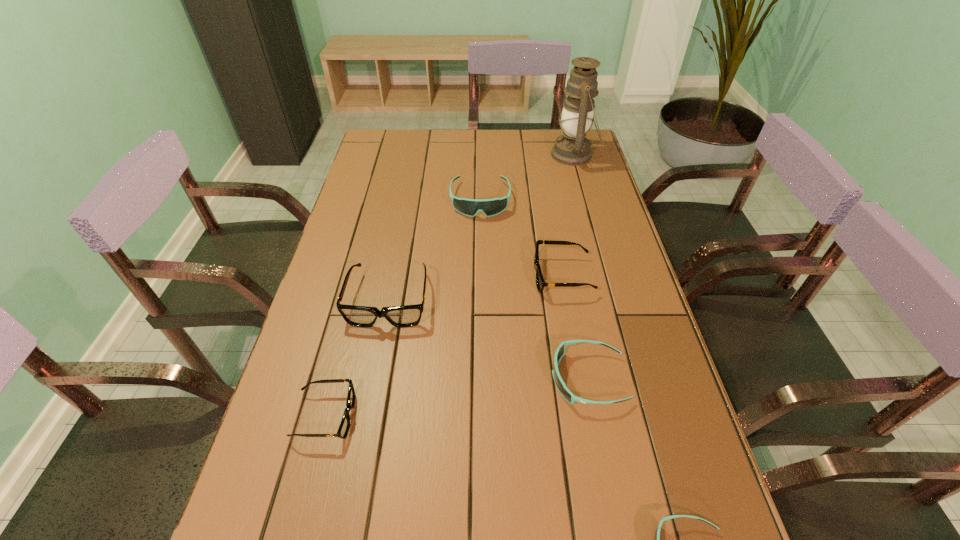
Where is `empty space that is in between the second biggest cyan sunglasses and the rightmost black sunglasses`? This screenshot has height=540, width=960. empty space that is in between the second biggest cyan sunglasses and the rightmost black sunglasses is located at coordinates (575, 327).

What are the coordinates of `vacant area that lies between the farthest sunglasses and the brown oil lamp` in the screenshot? It's located at (527, 177).

Find the location of a particular element. The image size is (960, 540). free space between the second smallest black sunglasses and the second nearest cyan sunglasses is located at coordinates (575, 327).

Identify the location of object identified as the second closest to the smallest black sunglasses. (564, 391).

You are a GUI agent. You are given a task and a screenshot of the screen. Output one action in this format:
    pyautogui.click(x=<x>, y=<y>)
    Task: Click on the object that is the third nearest to the farthest object
    The height and width of the screenshot is (540, 960).
    Given the screenshot: What is the action you would take?
    pyautogui.click(x=403, y=316)

The width and height of the screenshot is (960, 540). I want to click on sunglasses that is the second nearest to the second smallest black sunglasses, so click(470, 207).

This screenshot has width=960, height=540. I want to click on sunglasses that is the fourth nearest to the fourth sunglasses from right to left, so click(x=343, y=429).

Choose which black sunglasses is the third nearest neighbor to the nearest sunglasses. Please provide its 2D coordinates. Your answer should be formatted as a tuple, i.e. [(x, y)], where the tuple contains the x and y coordinates of a point satisfying the conditions above.

[(403, 316)]

Image resolution: width=960 pixels, height=540 pixels. What are the coordinates of `black sunglasses that is the closest one to the second biggest black sunglasses` in the screenshot? It's located at (403, 316).

Point out which cyan sunglasses is positioned as the nearest to the rightmost black sunglasses. Please provide its 2D coordinates. Your answer should be formatted as a tuple, i.e. [(x, y)], where the tuple contains the x and y coordinates of a point satisfying the conditions above.

[(564, 391)]